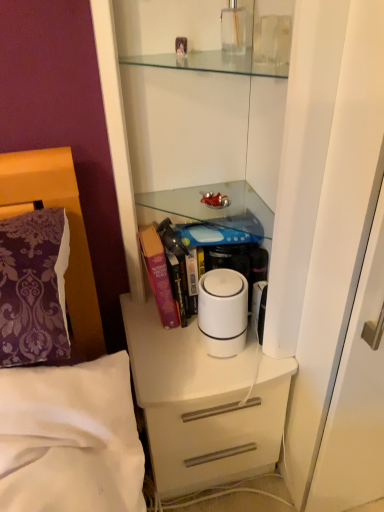
You are a GUI agent. You are given a task and a screenshot of the screen. Output one action in this format:
    pyautogui.click(x=<x>, y=<y>)
    Task: Click on the free space that is to the left of white plastic humidifier at center
    
    Given the screenshot: What is the action you would take?
    pyautogui.click(x=160, y=348)